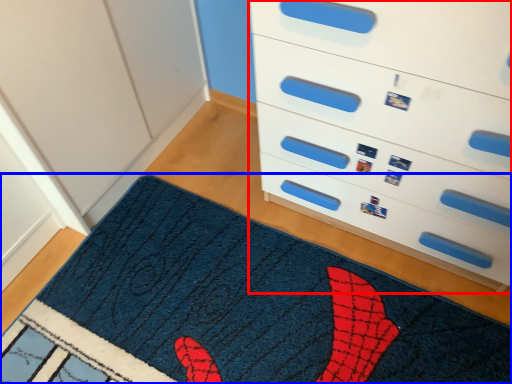
Question: Which object appears closest to the camera in this image, chest of drawers (highlighted by a red box) or mat (highlighted by a blue box)?

Choices:
 (A) chest of drawers
 (B) mat

Answer: (A)